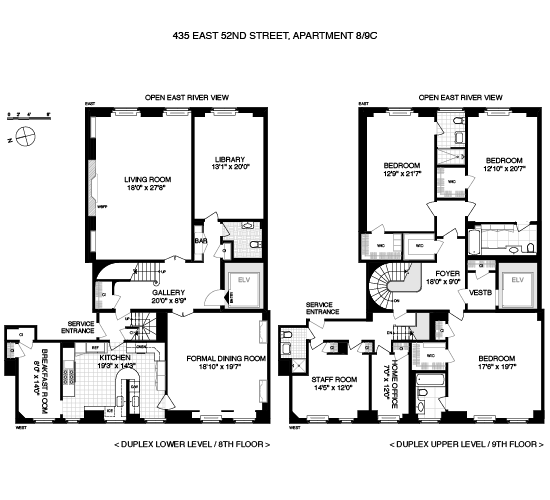
I want to click on formal dining room area, so click(219, 376).